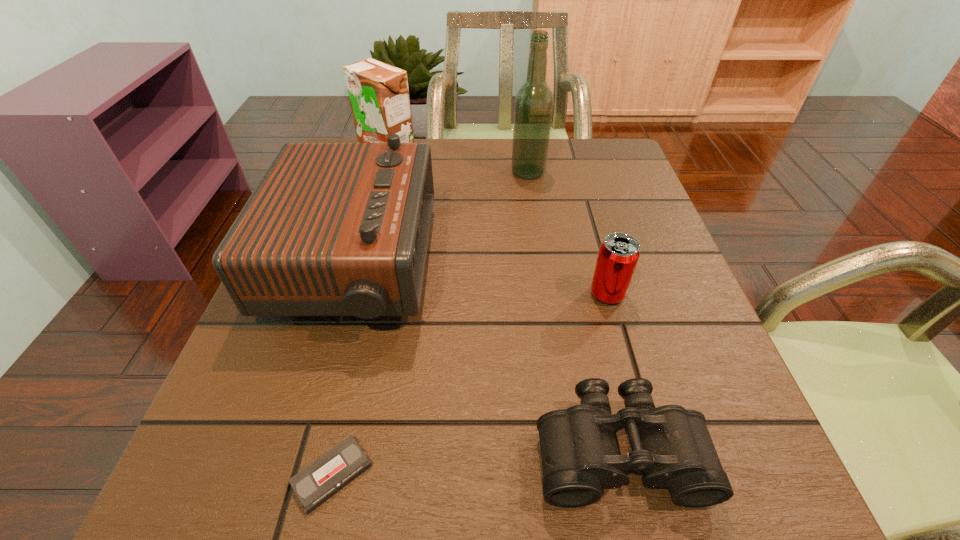
This screenshot has width=960, height=540. Identify the location of vacant space situated 0.170m on the right of the shortest object. (498, 475).

Find the location of `liquor situated at the far edge`. liquor situated at the far edge is located at coordinates (533, 109).

You are a GUI agent. You are given a task and a screenshot of the screen. Output one action in this format:
    pyautogui.click(x=<x>, y=<y>)
    Task: Click on the carton that is at the far edge
    
    Given the screenshot: What is the action you would take?
    pyautogui.click(x=379, y=97)

Locate an element on the screen. This screenshot has width=960, height=540. binoculars at the near edge is located at coordinates (671, 445).

Find the location of a particular element. videotape that is at the near edge is located at coordinates point(319,481).

This screenshot has width=960, height=540. What are the coordinates of `carton positioned at the left edge` in the screenshot? It's located at (379, 97).

At what (x,y) coordinates should I click in order to perform the action: click on radio receiver located in the left edge section of the desktop. Please return your answer as a coordinate pair (x, y). Image resolution: width=960 pixels, height=540 pixels. Looking at the image, I should click on (x=332, y=229).

The height and width of the screenshot is (540, 960). Find the location of `videotape present at the left edge`. videotape present at the left edge is located at coordinates (319, 481).

Locate an element on the screen. The width and height of the screenshot is (960, 540). soda can situated at the right edge is located at coordinates (618, 255).

Find the location of a particular element. binoculars positioned at the right edge is located at coordinates (671, 445).